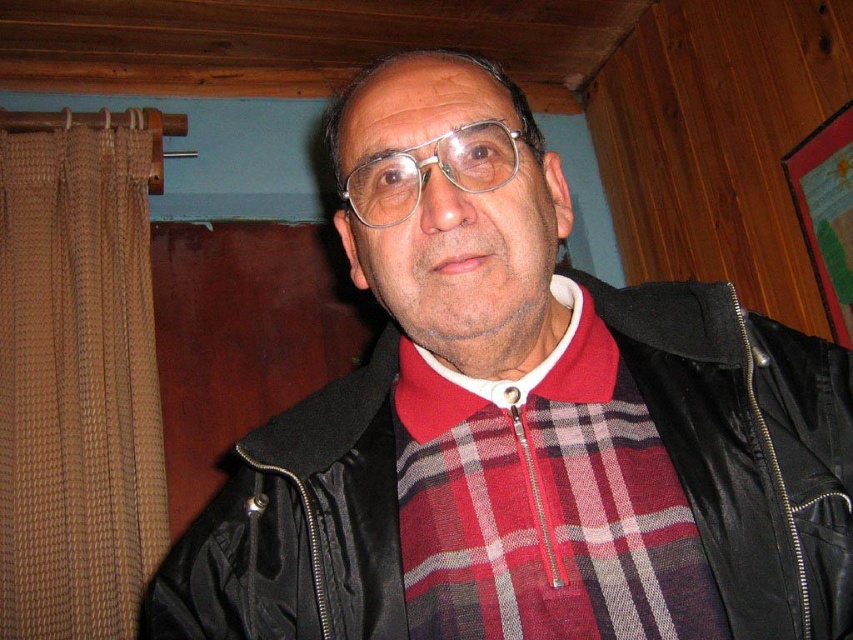
You are standing in the room and want to move from the point at coordinates point (432, 467) to the point at coordinates point (488, 125). Can you walk directly between them without any obstacles?

Point point (432, 467) is behind point point (488, 125), so you cannot walk directly between them without passing through the latter point first.